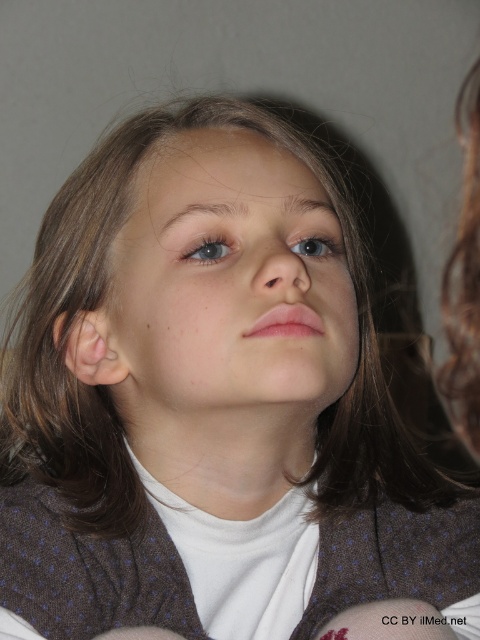
Question: Does smooth skin face at center lie behind blue matte eye at center?

Choices:
 (A) yes
 (B) no

Answer: (B)

Question: Among these objects, which one is farthest from the camera?

Choices:
 (A) smooth skin face at center
 (B) blue matte eye at center

Answer: (B)

Question: Which object is positioned closest to the blue matte eye at center?

Choices:
 (A) smooth skin face at center
 (B) blue glossy eye at upper center

Answer: (B)

Question: Which of the following is the closest to the observer?

Choices:
 (A) (297, 252)
 (B) (193, 390)

Answer: (B)

Question: Is smooth skin face at center smaller than blue glossy eye at upper center?

Choices:
 (A) no
 (B) yes

Answer: (A)

Question: Is blue matte eye at center positioned before blue glossy eye at upper center?

Choices:
 (A) yes
 (B) no

Answer: (A)